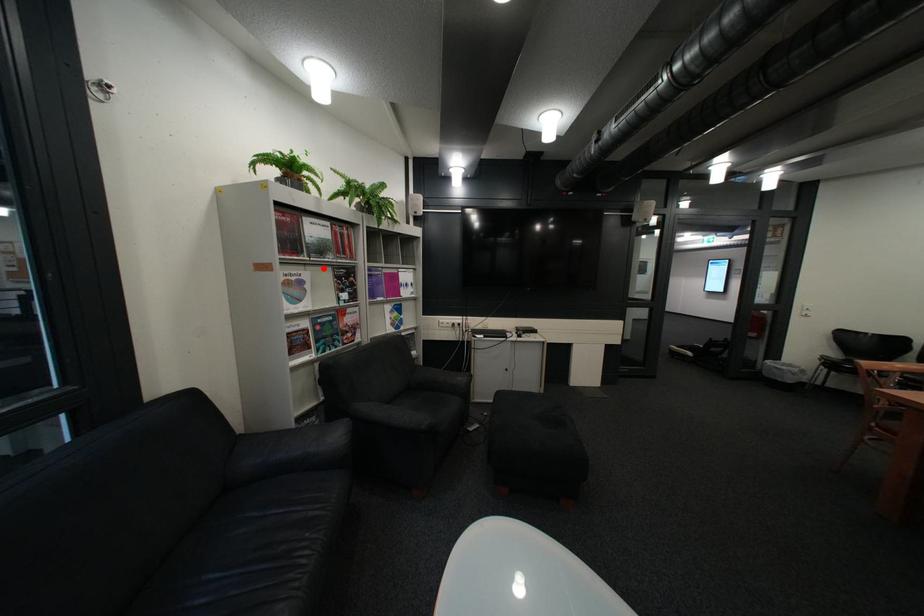
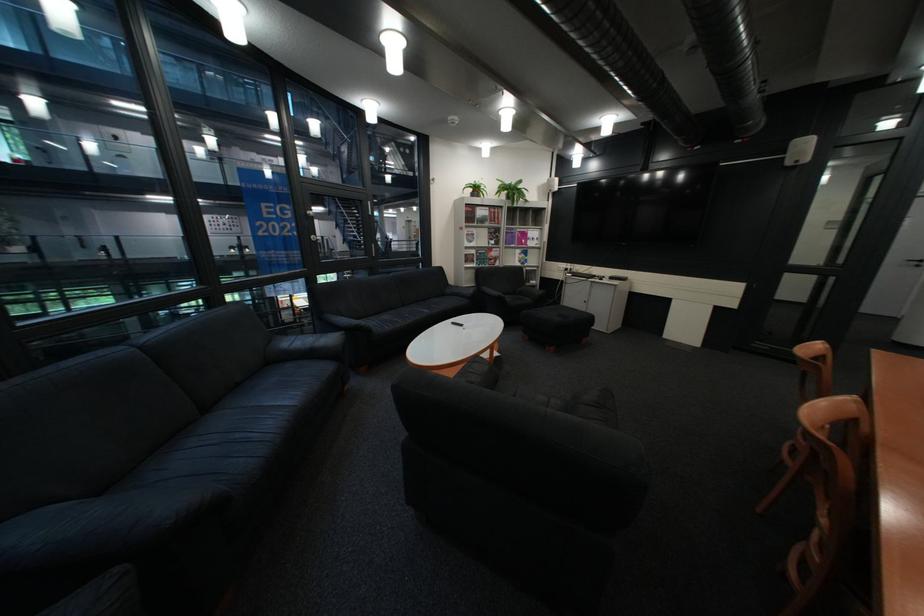
Question: I am providing you with two images of the same scene from different viewpoints. Given a red point in image1, look at the same physical point in image2. Is it:

Choices:
 (A) Closer to the viewpoint
 (B) Farther from the viewpoint

Answer: (A)